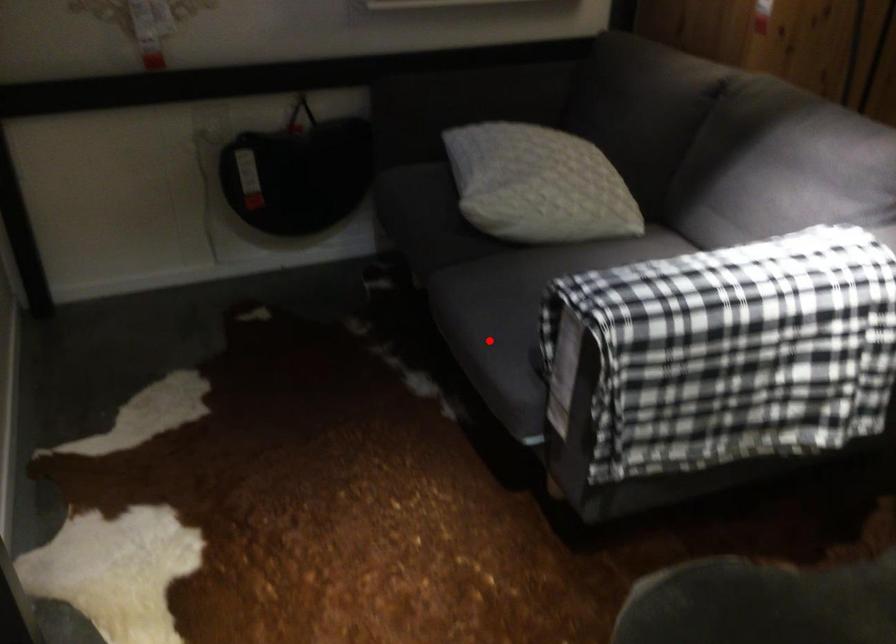
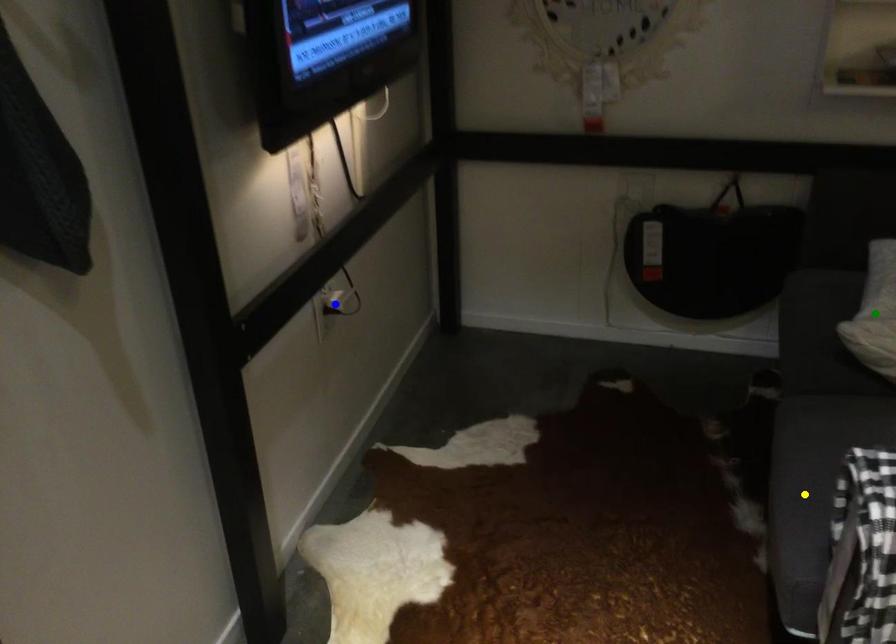
Question: I am providing you with two images of the same scene from different viewpoints. A red point is marked on the first image. You are given multiple points on the second image. Which point in image 2 is actually the same real-world point as the red point in image 1?

Choices:
 (A) green point
 (B) blue point
 (C) yellow point

Answer: (C)